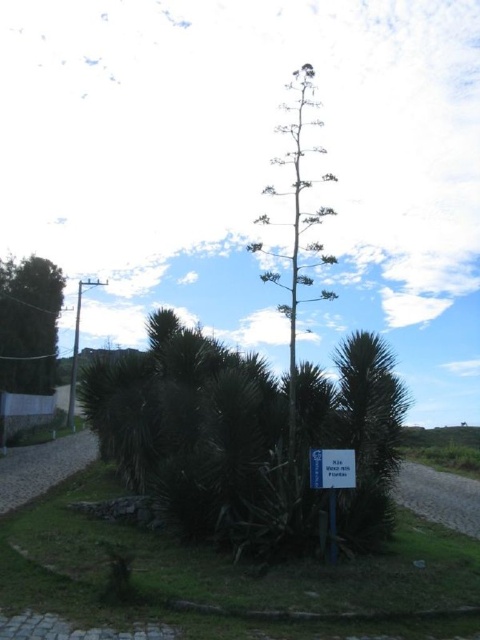
Question: Is green spiky palm tree at center to the right of white plastic sign at center from the viewer's perspective?

Choices:
 (A) yes
 (B) no

Answer: (A)

Question: Which point is closer to the camera?

Choices:
 (A) white plastic sign at center
 (B) blue plastic sign at center
 (C) dark green leafy tree at left
 (D) green spiky palm tree at center

Answer: (B)

Question: Does dark green leafy tree at left lie behind blue plastic sign at center?

Choices:
 (A) yes
 (B) no

Answer: (A)

Question: Which point is farther to the camera?

Choices:
 (A) (360, 442)
 (B) (315, 454)
 (C) (336, 461)

Answer: (A)

Question: Which point appears closest to the camera in this image?

Choices:
 (A) (360, 493)
 (B) (15, 332)
 (C) (335, 552)

Answer: (C)

Question: Can you confirm if green spiky palm tree at center is positioned below dark green leafy tree at left?

Choices:
 (A) no
 (B) yes

Answer: (B)